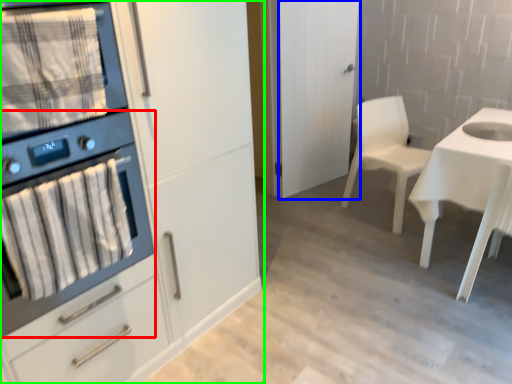
Question: Which object is the closest to the kitchen appliance (highlighted by a red box)? Choose among these: glass door (highlighted by a blue box) or cabinetry (highlighted by a green box).

Choices:
 (A) glass door
 (B) cabinetry

Answer: (B)